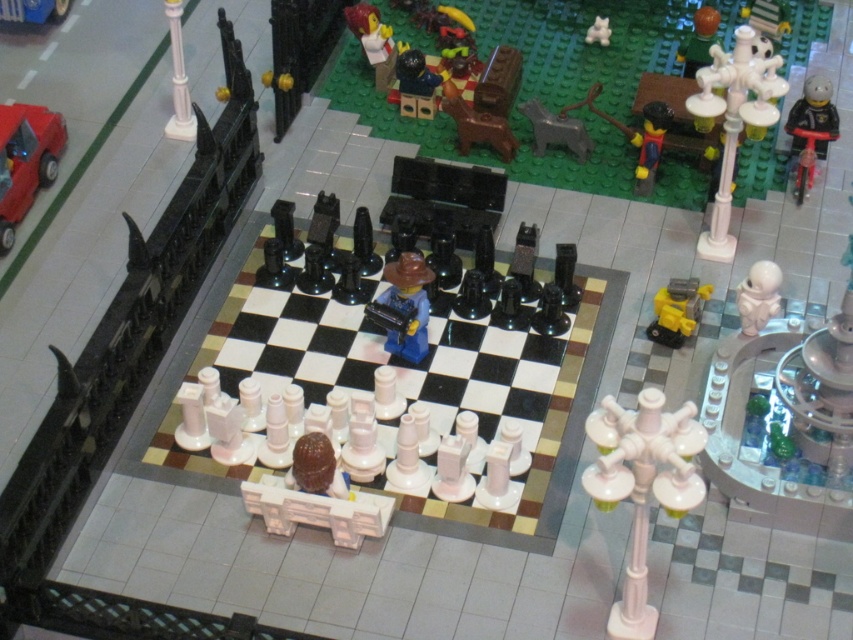
Question: Is shiny red car at left smaller than blue matte cowboy hat at center?

Choices:
 (A) yes
 (B) no

Answer: (B)

Question: Which object is positioned closest to the smooth brown chess piece at upper center?

Choices:
 (A) white glossy streetlamp at center right
 (B) metallic blue car at upper left

Answer: (B)

Question: Does black plastic toy at upper right have a greater width compared to yellow plastic car at lower right?

Choices:
 (A) no
 (B) yes

Answer: (A)

Question: Where is white glossy streetlamp at upper right located in relation to black plastic toy at upper right in the image?

Choices:
 (A) above
 (B) below

Answer: (B)

Question: Which object is the farthest from the white glossy streetlamp at center right?

Choices:
 (A) white plastic cat at upper center
 (B) yellow plastic car at lower right
 (C) metallic blue car at upper left

Answer: (C)

Question: Which object is closer to the camera taking this photo?

Choices:
 (A) white glossy streetlamp at center right
 (B) black plastic toy at upper right
 (C) white glossy streetlamp at upper right

Answer: (A)